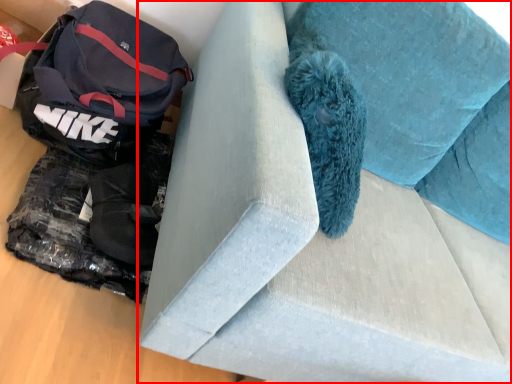
Question: From the image's perspective, where is furniture (annotated by the red box) located relative to luggage and bags?

Choices:
 (A) above
 (B) below

Answer: (B)